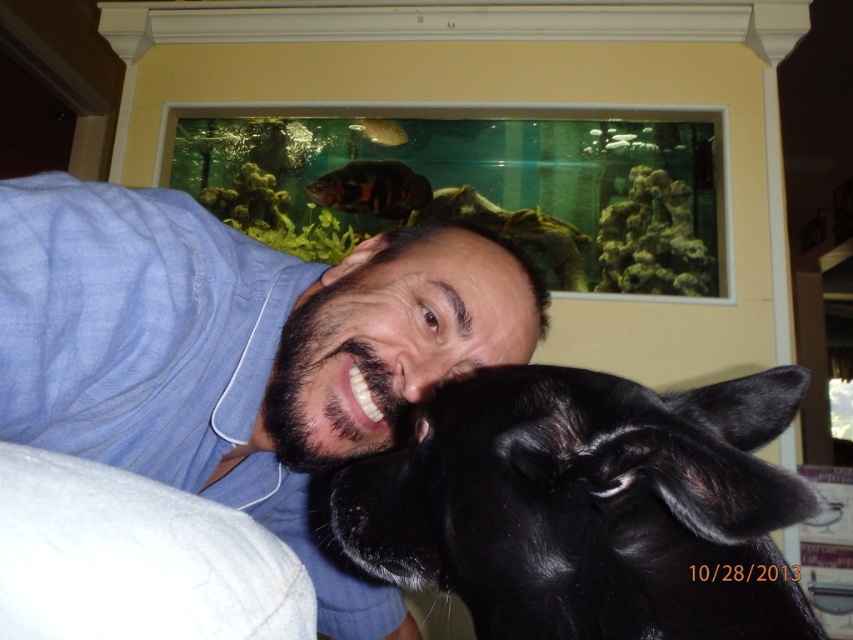
Looking at this image, between blue cotton shirt at center and shiny black fish at upper center, which one appears on the left side from the viewer's perspective?

shiny black fish at upper center is more to the left.

Can you confirm if blue cotton shirt at center is positioned to the right of shiny black fish at upper center?

Yes, blue cotton shirt at center is to the right of shiny black fish at upper center.

Locate an element on the screen. blue cotton shirt at center is located at coordinates (239, 352).

This screenshot has height=640, width=853. Identify the location of blue cotton shirt at center. (239, 352).

Is blue cotton shirt at center below black shiny fur at center?

Indeed, blue cotton shirt at center is positioned under black shiny fur at center.

Between blue cotton shirt at center and black shiny fur at center, which one has more height?

With more height is blue cotton shirt at center.

You are a GUI agent. You are given a task and a screenshot of the screen. Output one action in this format:
    pyautogui.click(x=<x>, y=<y>)
    Task: Click on the blue cotton shirt at center
    This screenshot has width=853, height=640.
    Given the screenshot: What is the action you would take?
    pyautogui.click(x=239, y=352)

Where is `blue cotton shirt at center`? This screenshot has height=640, width=853. blue cotton shirt at center is located at coordinates (239, 352).

Does black shiny fur at center appear under shiny black fish at upper center?

Indeed, black shiny fur at center is positioned under shiny black fish at upper center.

Which is behind, point (581, 596) or point (335, 202)?

Point (335, 202)

Is point (579, 550) positioned in front of point (374, 202)?

Yes, it is in front of point (374, 202).

I want to click on black shiny fur at center, so click(589, 506).